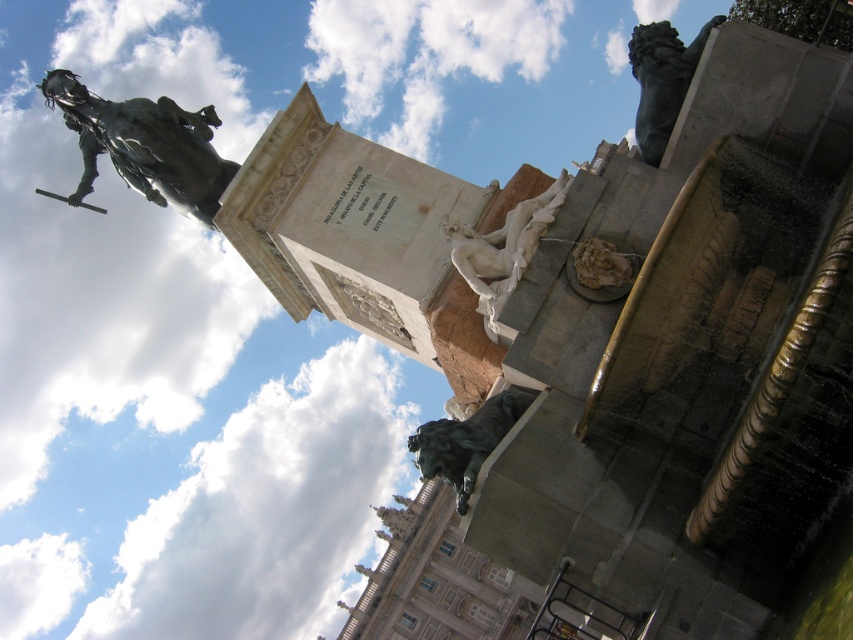
Question: Can you confirm if bronze lion at upper right is positioned to the left of bronze statue at lower right?

Choices:
 (A) yes
 (B) no

Answer: (B)

Question: Is bronze lion at upper right closer to the viewer compared to bronze statue at lower right?

Choices:
 (A) no
 (B) yes

Answer: (A)

Question: Based on their relative distances, which object is farther from the bronze statue at lower right?

Choices:
 (A) bronze lion at upper right
 (B) white marble statue at center

Answer: (A)

Question: Is bronze lion at upper right bigger than white marble statue at center?

Choices:
 (A) yes
 (B) no

Answer: (A)

Question: Which object is closer to the camera taking this photo?

Choices:
 (A) bronze lion at upper right
 (B) bronze statue at upper left

Answer: (A)

Question: Estimate the real-world distances between objects in this image. Which object is closer to the white marble statue at center?

Choices:
 (A) bronze statue at upper left
 (B) bronze lion at upper right

Answer: (B)